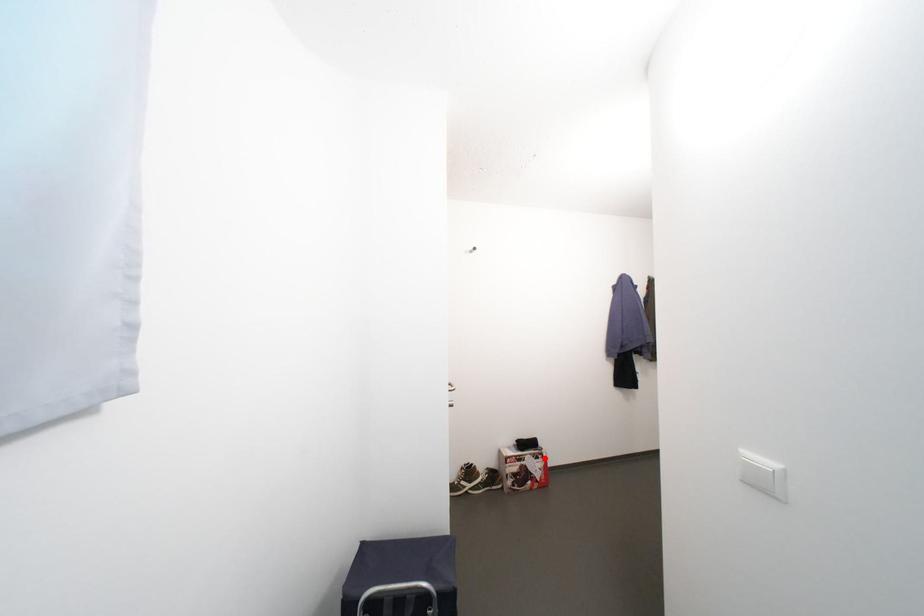
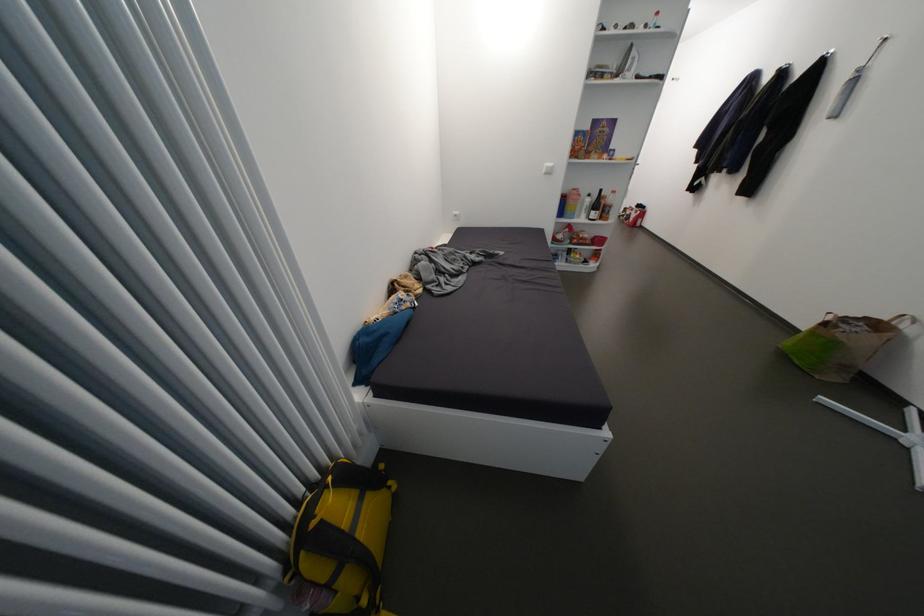
Question: I am providing you with two images of the same scene from different viewpoints. Given a red point in image1, look at the same physical point in image2. Is it:

Choices:
 (A) Closer to the viewpoint
 (B) Farther from the viewpoint

Answer: (B)